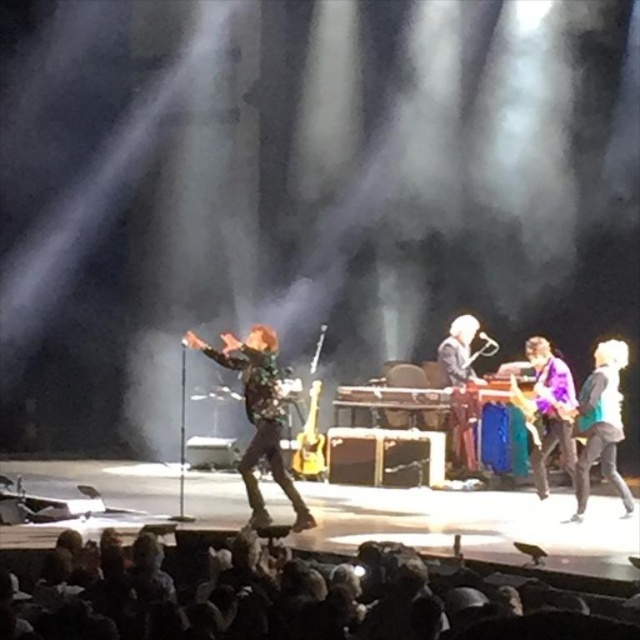
Which of these two, flannel shirt at center or shiny silver guitar at center, stands shorter?

flannel shirt at center

Who is positioned more to the left, flannel shirt at center or shiny silver guitar at center?

flannel shirt at center is more to the left.

Find the location of a particular element. This screenshot has width=640, height=640. flannel shirt at center is located at coordinates (259, 417).

Image resolution: width=640 pixels, height=640 pixels. What are the coordinates of `flannel shirt at center` in the screenshot? It's located at (259, 417).

Measure the distance between flannel shirt at center and camera.

flannel shirt at center and camera are 20.82 feet apart from each other.

Is flannel shirt at center positioned behind teal fabric jacket at right?

No, flannel shirt at center is in front of teal fabric jacket at right.

What do you see at coordinates (259, 417) in the screenshot?
I see `flannel shirt at center` at bounding box center [259, 417].

What are the coordinates of `flannel shirt at center` in the screenshot? It's located at (259, 417).

Describe the element at coordinates (550, 410) in the screenshot. The height and width of the screenshot is (640, 640). I see `purple glossy guitar at right` at that location.

Between purple glossy guitar at right and shiny silver guitar at center, which one has less height?

With less height is purple glossy guitar at right.

Between point (534, 403) and point (444, 339), which one is positioned behind?

Point (444, 339)

The width and height of the screenshot is (640, 640). What are the coordinates of `purple glossy guitar at right` in the screenshot? It's located at (550, 410).